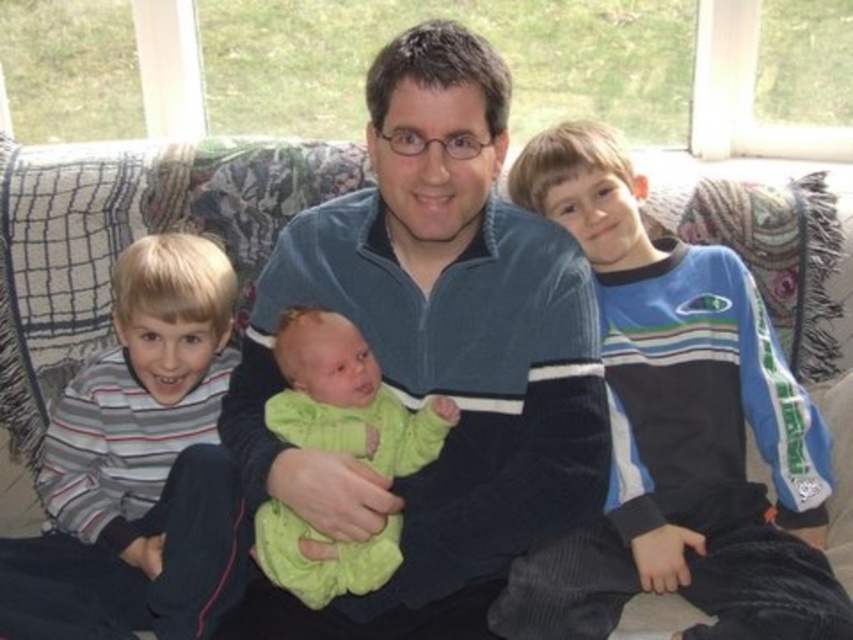
Looking at this image, measure the distance between blue velour jacket at right and camera.

blue velour jacket at right is 1.21 meters from camera.

Looking at this image, is blue velour jacket at right shorter than soft green knit sweater at center?

Incorrect, blue velour jacket at right's height does not fall short of soft green knit sweater at center's.

Locate an element on the screen. blue velour jacket at right is located at coordinates (677, 429).

Which is behind, point (62, 625) or point (396, 419)?

Positioned behind is point (396, 419).

Between striped cotton shirt at left and soft green knit sweater at center, which one is positioned higher?

striped cotton shirt at left is above.

Find the location of a particular element. striped cotton shirt at left is located at coordinates (142, 464).

Can you confirm if blue velour jacket at right is smaller than striped cotton shirt at left?

Incorrect, blue velour jacket at right is not smaller in size than striped cotton shirt at left.

Can you confirm if blue velour jacket at right is positioned to the right of striped cotton shirt at left?

Indeed, blue velour jacket at right is positioned on the right side of striped cotton shirt at left.

What do you see at coordinates (677, 429) in the screenshot?
I see `blue velour jacket at right` at bounding box center [677, 429].

Locate an element on the screen. This screenshot has height=640, width=853. blue velour jacket at right is located at coordinates (677, 429).